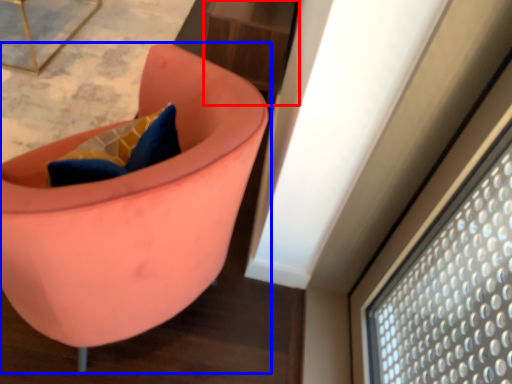
Question: Among these objects, which one is nearest to the camera, table (highlighted by a red box) or chair (highlighted by a blue box)?

Choices:
 (A) table
 (B) chair

Answer: (B)